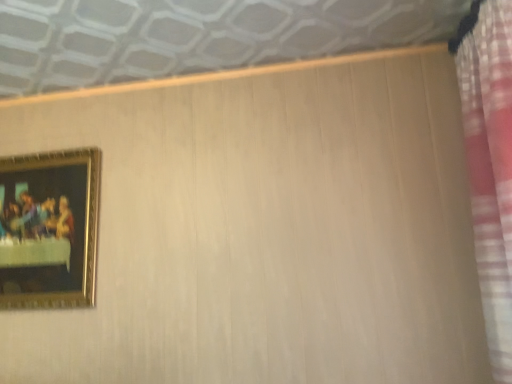
What do you see at coordinates (49, 229) in the screenshot? The height and width of the screenshot is (384, 512). I see `gold-framed painting at upper left` at bounding box center [49, 229].

The height and width of the screenshot is (384, 512). What are the coordinates of `gold-framed painting at upper left` in the screenshot? It's located at (49, 229).

This screenshot has width=512, height=384. What are the coordinates of `gold-framed painting at upper left` in the screenshot? It's located at (49, 229).